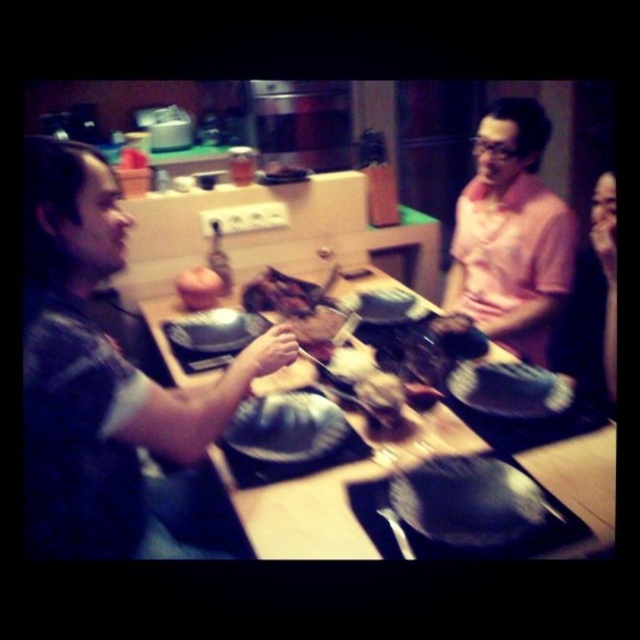
You are a chef preparing a dish and need to place the brown matte food at center onto the shiny black pan at center. Based on the scene description, can you determine if the pan is positioned in a way that allows the food to be placed directly on top of it?

The shiny black pan at center is located below the brown matte food at center, so yes, the pan is positioned directly underneath the food, allowing it to be placed on top without any adjustment needed.